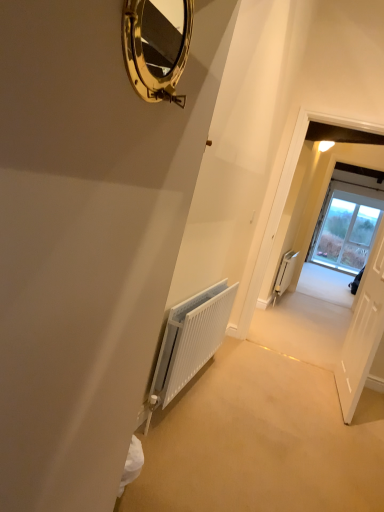
Question: Considering the relative sizes of white textured radiator at center, which is the first radiator from front to back, and white matte radiator at right, the first radiator from the right, in the image provided, is white textured radiator at center, which is the first radiator from front to back, smaller than white matte radiator at right, the first radiator from the right,?

Choices:
 (A) yes
 (B) no

Answer: (A)

Question: From a real-world perspective, is white textured radiator at center, placed as the 2th radiator when sorted from back to front, positioned under white matte radiator at right, which ranks as the 1th radiator in back-to-front order, based on gravity?

Choices:
 (A) no
 (B) yes

Answer: (A)

Question: Can you confirm if white textured radiator at center, the first radiator from the left, is bigger than white matte radiator at right, which ranks as the 1th radiator in back-to-front order?

Choices:
 (A) no
 (B) yes

Answer: (A)

Question: Can you confirm if white textured radiator at center, which is the first radiator from front to back, is positioned to the right of white matte radiator at right, which ranks as the 1th radiator in back-to-front order?

Choices:
 (A) no
 (B) yes

Answer: (A)

Question: Based on their sizes in the image, would you say white matte radiator at right, which appears as the 2th radiator when viewed from the front, is bigger or smaller than white wooden door at right?

Choices:
 (A) small
 (B) big

Answer: (B)

Question: Is white matte radiator at right, the first radiator from the right, spatially inside white wooden door at right, or outside of it?

Choices:
 (A) outside
 (B) inside

Answer: (A)

Question: In the image, is white matte radiator at right, the first radiator from the right, positioned in front of or behind white wooden door at right?

Choices:
 (A) behind
 (B) front

Answer: (A)

Question: From a real-world perspective, is white matte radiator at right, which ranks as the 1th radiator in back-to-front order, physically located above or below white wooden door at right?

Choices:
 (A) above
 (B) below

Answer: (B)

Question: From their relative heights in the image, would you say white textured radiator at center, which is the first radiator from front to back, is taller or shorter than white wooden door at right?

Choices:
 (A) short
 (B) tall

Answer: (A)

Question: From the image's perspective, relative to white wooden door at right, is white textured radiator at center, placed as the second radiator when sorted from right to left, above or below?

Choices:
 (A) above
 (B) below

Answer: (B)

Question: From a real-world perspective, is white textured radiator at center, placed as the 2th radiator when sorted from back to front, positioned above or below white wooden door at right?

Choices:
 (A) above
 (B) below

Answer: (B)

Question: In terms of width, does white textured radiator at center, the first radiator from the left, look wider or thinner when compared to white wooden door at right?

Choices:
 (A) wide
 (B) thin

Answer: (A)

Question: Considering the positions of gold polished mirror at upper center and white glossy door at center in the image, is gold polished mirror at upper center wider or thinner than white glossy door at center?

Choices:
 (A) thin
 (B) wide

Answer: (A)

Question: Do you think gold polished mirror at upper center is within white glossy door at center, or outside of it?

Choices:
 (A) inside
 (B) outside

Answer: (B)